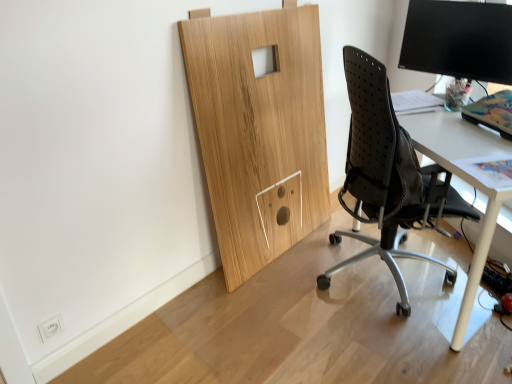
Locate an element on the screen. The height and width of the screenshot is (384, 512). free spot in front of black mesh chair at right is located at coordinates (382, 354).